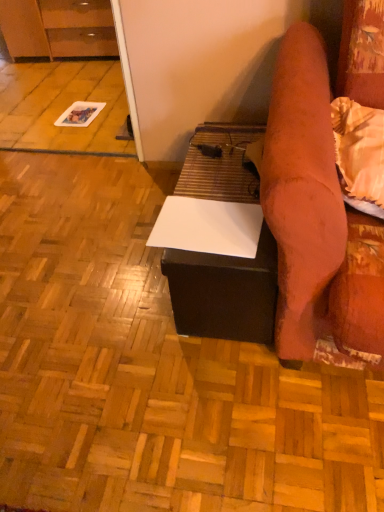
Question: Is matte brown cabinet at upper left smaller than white matte table at center?

Choices:
 (A) no
 (B) yes

Answer: (A)

Question: Can you confirm if matte brown cabinet at upper left is thinner than white matte table at center?

Choices:
 (A) yes
 (B) no

Answer: (A)

Question: Does matte brown cabinet at upper left appear on the left side of white matte table at center?

Choices:
 (A) yes
 (B) no

Answer: (A)

Question: Does matte brown cabinet at upper left come in front of white matte table at center?

Choices:
 (A) no
 (B) yes

Answer: (A)

Question: Can you confirm if matte brown cabinet at upper left is wider than white matte table at center?

Choices:
 (A) no
 (B) yes

Answer: (A)

Question: In terms of width, does white matte paper at center look wider or thinner when compared to white matte table at center?

Choices:
 (A) wide
 (B) thin

Answer: (A)

Question: From a real-world perspective, relative to white matte table at center, is white matte paper at center vertically above or below?

Choices:
 (A) above
 (B) below

Answer: (B)

Question: Is point (96, 451) closer or farther from the camera than point (225, 333)?

Choices:
 (A) closer
 (B) farther

Answer: (A)

Question: Relative to white matte table at center, is white matte paper at center in front or behind?

Choices:
 (A) behind
 (B) front

Answer: (B)

Question: Considering the positions of white matte table at center and matte brown cabinet at upper left in the image, is white matte table at center taller or shorter than matte brown cabinet at upper left?

Choices:
 (A) tall
 (B) short

Answer: (B)

Question: Does point (195, 287) appear closer or farther from the camera than point (36, 38)?

Choices:
 (A) closer
 (B) farther

Answer: (A)

Question: In the image, is white matte table at center on the left side or the right side of matte brown cabinet at upper left?

Choices:
 (A) left
 (B) right

Answer: (B)

Question: In the image, is white matte table at center positioned in front of or behind matte brown cabinet at upper left?

Choices:
 (A) front
 (B) behind

Answer: (A)

Question: From a real-world perspective, is white matte paper at center physically located above or below matte brown cabinet at upper left?

Choices:
 (A) below
 (B) above

Answer: (A)

Question: Considering the positions of point (49, 424) and point (16, 26), is point (49, 424) closer or farther from the camera than point (16, 26)?

Choices:
 (A) farther
 (B) closer

Answer: (B)